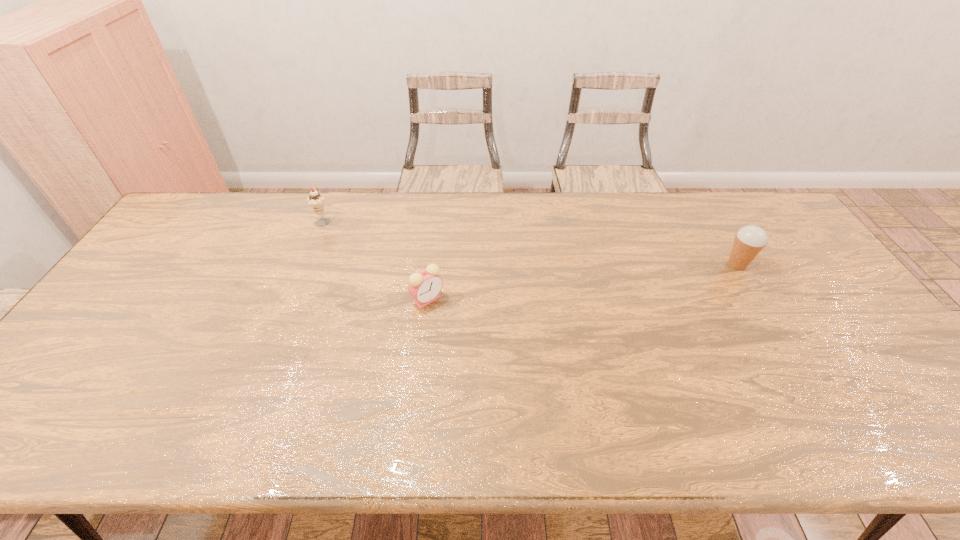
Where is `the farther icecream`? the farther icecream is located at coordinates (315, 200).

What are the coordinates of `the farthest object` in the screenshot? It's located at (315, 200).

This screenshot has height=540, width=960. I want to click on the second farthest object, so click(x=749, y=241).

Where is `the rightmost object`? the rightmost object is located at coordinates (749, 241).

Locate an element on the screen. alarm clock is located at coordinates (425, 285).

You are a GUI agent. You are given a task and a screenshot of the screen. Output one action in this format:
    pyautogui.click(x=<x>, y=<y>)
    Task: Click on the second object from right to left
    Image resolution: width=960 pixels, height=540 pixels.
    Given the screenshot: What is the action you would take?
    pyautogui.click(x=425, y=285)

This screenshot has width=960, height=540. I want to click on vacant area located 0.070m on the left of the farthest object, so click(x=294, y=221).

Identify the location of free point located 0.320m on the back of the second farthest object. The width and height of the screenshot is (960, 540). (696, 195).

The height and width of the screenshot is (540, 960). What are the coordinates of `vacant space located 0.050m on the face of the alarm clock` in the screenshot? It's located at (424, 325).

You are a GUI agent. You are given a task and a screenshot of the screen. Output one action in this format:
    pyautogui.click(x=<x>, y=<y>)
    Task: Click on the object present at the far edge
    The image size is (960, 540).
    Given the screenshot: What is the action you would take?
    pyautogui.click(x=315, y=200)